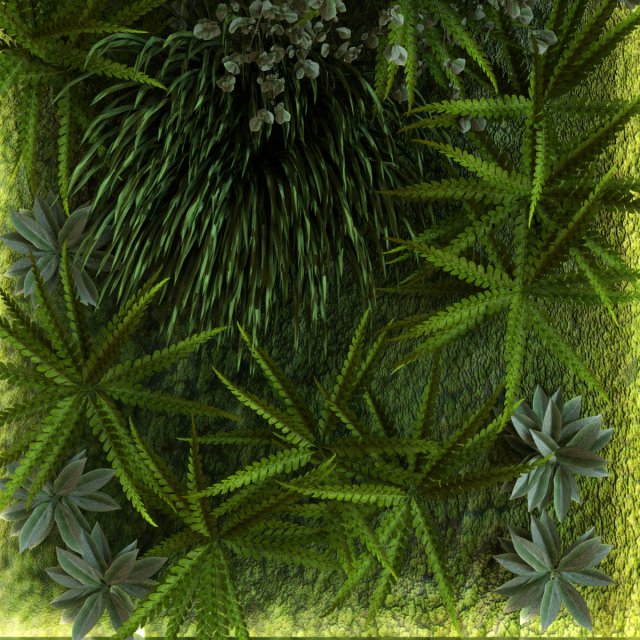
Image resolution: width=640 pixels, height=640 pixels. Find the location of `floor`. floor is located at coordinates (285, 620), (600, 355), (10, 168).